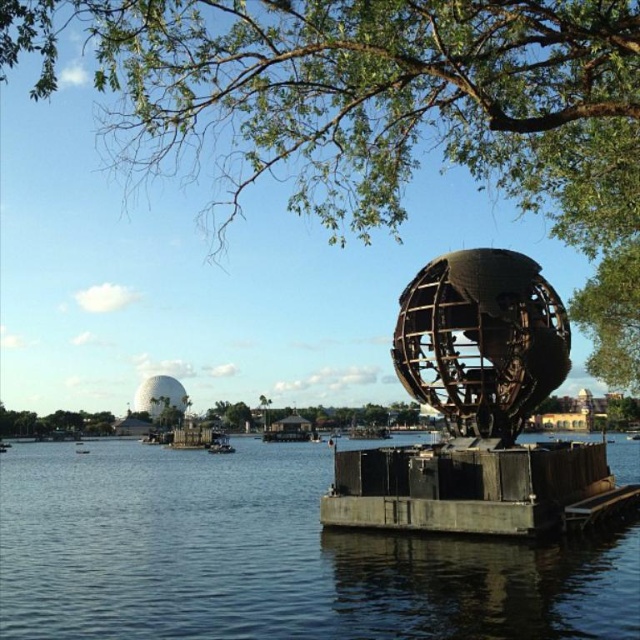
You are an artist planning to paint this waterfront scene. You want to emphasize the green leafy tree at upper center and the dark blue water at center. Which object should you paint larger to make the tree stand out more?

The green leafy tree at upper center has a larger size compared to dark blue water at center, so you should paint the green leafy tree at upper center larger to make it stand out more.

You are standing at the shore and want to reach the rustic wood dock at lower right. Which direction should you walk to get closer to it without crossing the dark blue water at center?

You should walk away from the dark blue water at center because the rustic wood dock at lower right is further away from the viewer than the dark blue water at center.

You are an artist planning to paint this waterfront scene. You want to ensure the green leafy tree at upper center and the rustic wood dock at lower right are proportionally accurate. Which object should you draw wider in your painting?

The green leafy tree at upper center should be drawn wider in the painting since its width is larger than the rustic wood dock at lower right.